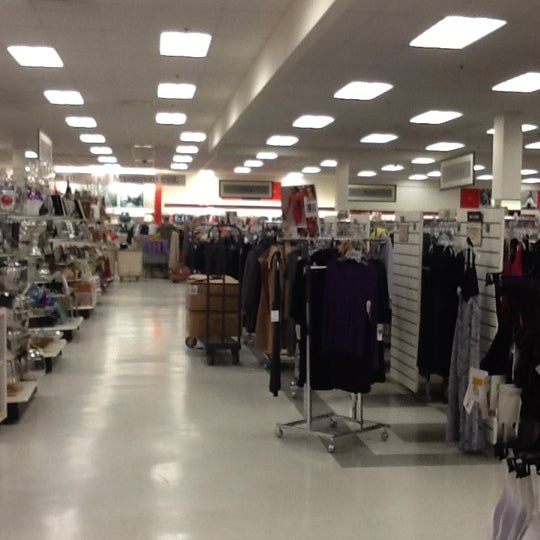
This screenshot has width=540, height=540. What are the coordinates of `hanger` in the screenshot? It's located at [333, 243], [445, 230].